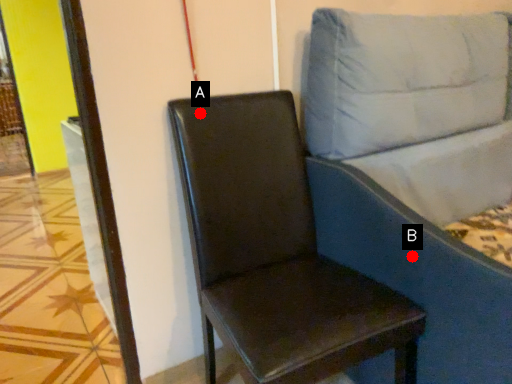
Question: Two points are circled on the image, labeled by A and B beside each circle. Which point appears closest to the camera in this image?

Choices:
 (A) A is closer
 (B) B is closer

Answer: (B)